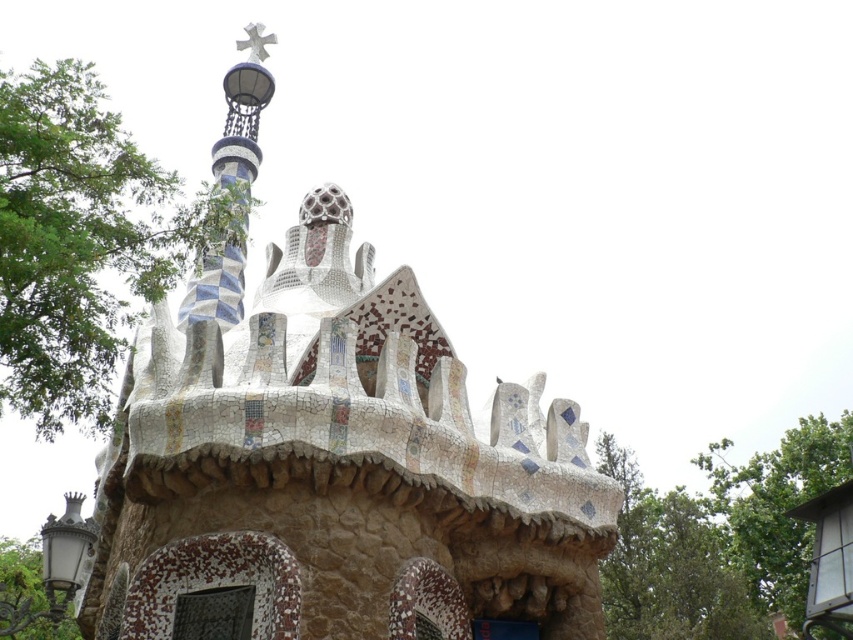
Question: Among these objects, which one is nearest to the camera?

Choices:
 (A) mosaic stone chapel at center
 (B) blue mosaic spire at upper left

Answer: (A)

Question: Does mosaic stone chapel at center have a smaller size compared to blue mosaic spire at upper left?

Choices:
 (A) no
 (B) yes

Answer: (A)

Question: Can you confirm if mosaic stone chapel at center is positioned above blue mosaic spire at upper left?

Choices:
 (A) no
 (B) yes

Answer: (A)

Question: Which point appears closest to the camera in this image?

Choices:
 (A) (393, 278)
 (B) (241, 291)

Answer: (A)

Question: Among these objects, which one is farthest from the camera?

Choices:
 (A) mosaic stone chapel at center
 (B) blue mosaic spire at upper left

Answer: (B)

Question: Can you confirm if mosaic stone chapel at center is positioned to the left of blue mosaic spire at upper left?

Choices:
 (A) no
 (B) yes

Answer: (A)